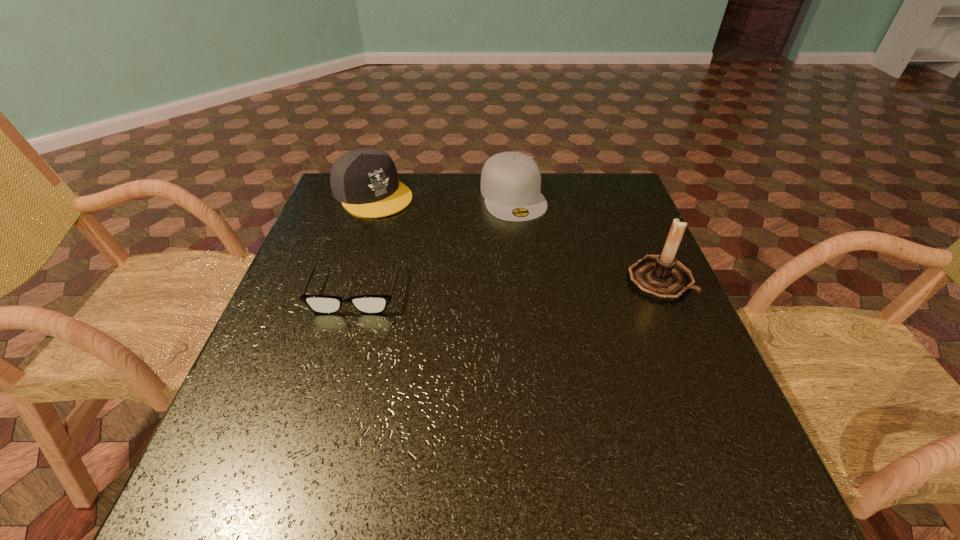
This screenshot has height=540, width=960. Find the location of `free spot located 0.110m on the front-facing side of the left cap`. free spot located 0.110m on the front-facing side of the left cap is located at coordinates (416, 231).

Identify the location of vacant space located on the front-facing side of the left cap. (405, 222).

At what (x,y) coordinates should I click in order to perform the action: click on free region located 0.120m on the front-facing side of the left cap. Please return your answer as a coordinate pair (x, y). This screenshot has width=960, height=540. Looking at the image, I should click on (418, 233).

The width and height of the screenshot is (960, 540). I want to click on spectacles positioned at the left edge, so click(x=322, y=304).

The image size is (960, 540). In order to click on cap that is at the left edge in this screenshot , I will do `click(365, 181)`.

This screenshot has width=960, height=540. Find the location of `object that is at the right edge`. object that is at the right edge is located at coordinates (661, 277).

Find the location of a particular element. object that is at the far left corner is located at coordinates (365, 181).

At what (x,y) coordinates should I click in order to perform the action: click on vacant space at the far edge of the desktop. Please return your answer as a coordinate pair (x, y). Looking at the image, I should click on (449, 198).

The width and height of the screenshot is (960, 540). I want to click on free region at the near edge of the desktop, so click(x=351, y=436).

You are a GUI agent. You are given a task and a screenshot of the screen. Output one action in this format:
    pyautogui.click(x=<x>, y=<y>)
    Task: Click on the vacant space at the left edge of the desktop
    This screenshot has height=540, width=960.
    Given the screenshot: What is the action you would take?
    pyautogui.click(x=313, y=238)